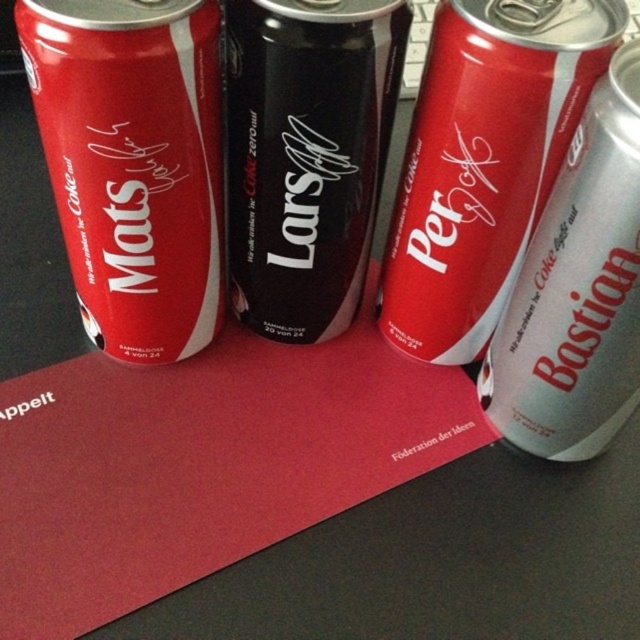
Question: Which of the following is the closest to the observer?

Choices:
 (A) matte black can at left
 (B) matte silver can at center
 (C) black matte can at center

Answer: (A)

Question: Based on their relative distances, which object is nearer to the matte silver can at center?

Choices:
 (A) silver metallic can at right
 (B) black matte can at center
 (C) matte black can at left

Answer: (A)

Question: Does matte black can at left have a larger size compared to silver metallic can at right?

Choices:
 (A) no
 (B) yes

Answer: (B)

Question: Which point is farther from the camera taking this photo?

Choices:
 (A) (276, 243)
 (B) (540, 289)
 (C) (195, 172)
 (D) (465, 160)

Answer: (A)

Question: Does matte black can at left have a greater width compared to matte silver can at center?

Choices:
 (A) yes
 (B) no

Answer: (B)

Question: Is matte silver can at center thinner than silver metallic can at right?

Choices:
 (A) yes
 (B) no

Answer: (B)